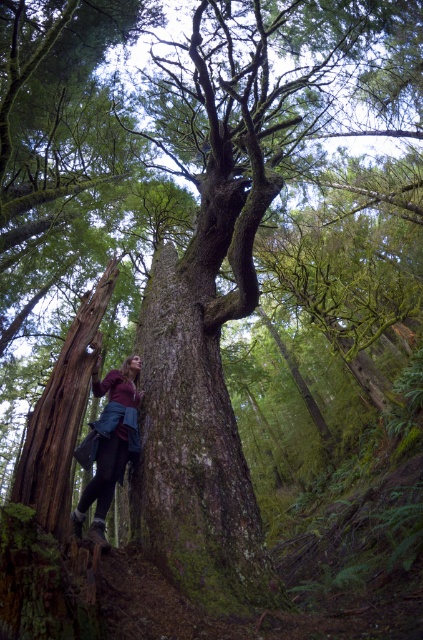
Question: Can you confirm if green mossy bark tree trunk at center is thinner than maroon fabric jacket at lower left?

Choices:
 (A) no
 (B) yes

Answer: (A)

Question: Which of the following is the closest to the observer?

Choices:
 (A) maroon fabric jacket at lower left
 (B) green mossy bark tree trunk at center

Answer: (A)

Question: Is green mossy bark tree trunk at center further to the viewer compared to maroon fabric jacket at lower left?

Choices:
 (A) no
 (B) yes

Answer: (B)

Question: Is green mossy bark tree trunk at center to the right of maroon fabric jacket at lower left from the viewer's perspective?

Choices:
 (A) no
 (B) yes

Answer: (B)

Question: Which object is closer to the camera taking this photo?

Choices:
 (A) green mossy bark tree trunk at center
 (B) maroon fabric jacket at lower left

Answer: (B)